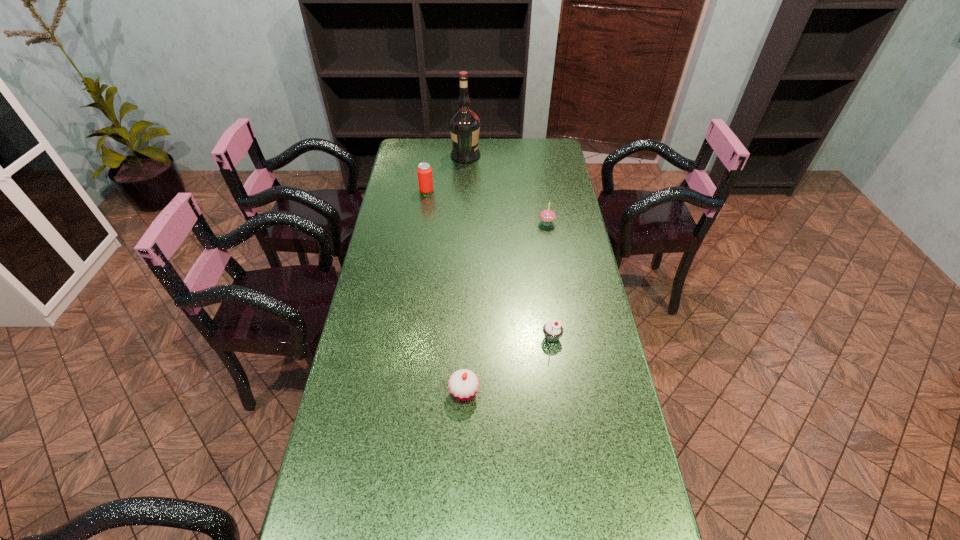
Locate an element on the screen. The image size is (960, 540). vacant space located 0.160m on the front of the farthest cupcake is located at coordinates (553, 258).

The width and height of the screenshot is (960, 540). Find the location of `vacant point located on the back of the fourth farthest object`. vacant point located on the back of the fourth farthest object is located at coordinates (548, 314).

Identify the location of vacant space situated 0.080m on the back of the leftmost cupcake. The image size is (960, 540). (466, 354).

At what (x,y) coordinates should I click in order to perform the action: click on object that is at the far edge. Please return your answer as a coordinate pair (x, y). Looking at the image, I should click on (464, 124).

Image resolution: width=960 pixels, height=540 pixels. In order to click on object present at the left edge in this screenshot , I will do (425, 179).

Identify the location of vacant space at the far edge of the desktop. Image resolution: width=960 pixels, height=540 pixels. [517, 151].

Locate an element on the screen. vacant space at the left edge is located at coordinates (325, 478).

Find the location of a particular element. vacant space at the right edge of the desktop is located at coordinates (557, 312).

In order to click on blank space at the far left corner in this screenshot , I will do `click(413, 141)`.

You are a GUI agent. You are given a task and a screenshot of the screen. Output one action in this format:
    pyautogui.click(x=<x>, y=<y>)
    Task: Click on the blank region between the beer can and the second farthest cupcake
    This screenshot has height=540, width=960.
    Given the screenshot: What is the action you would take?
    pyautogui.click(x=490, y=265)